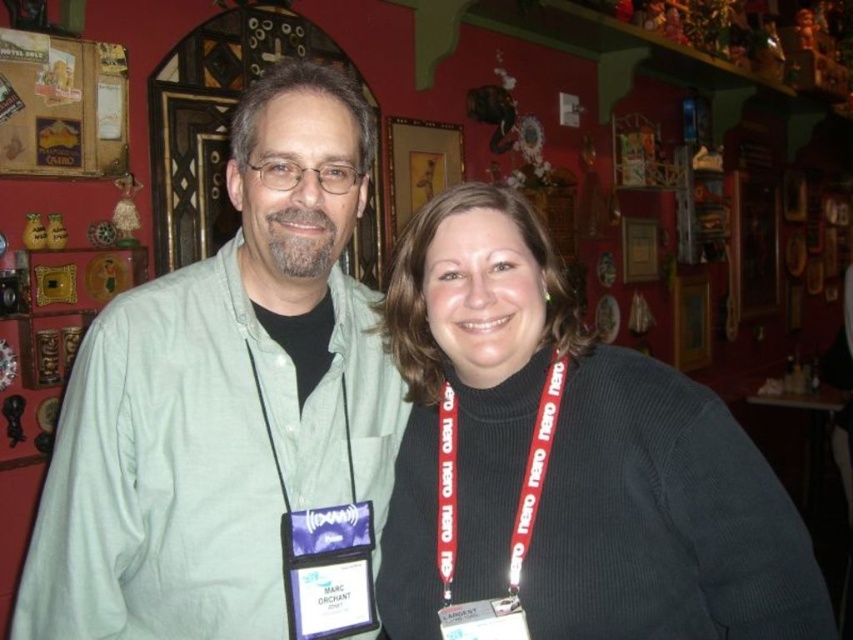
You are organizing a clothing donation drive and need to categorize items by size. If you have a storage box that can only accommodate garments narrower than the dark gray sweater at center, will the green cotton shirt at left fit inside?

The green cotton shirt at left has a width less than the dark gray sweater at center, so it will fit in the storage box designed for garments narrower than the dark gray sweater at center.